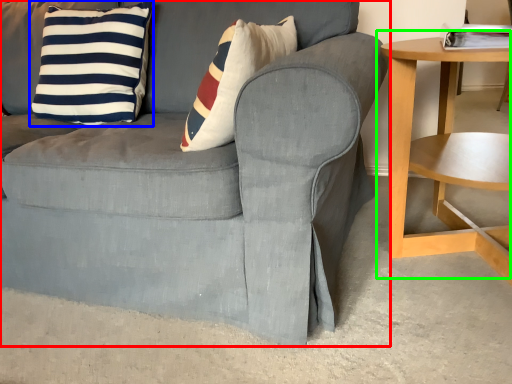
Question: Which object is the closest to the chair (highlighted by a red box)? Choose among these: pillow (highlighted by a blue box) or table (highlighted by a green box).

Choices:
 (A) pillow
 (B) table

Answer: (A)